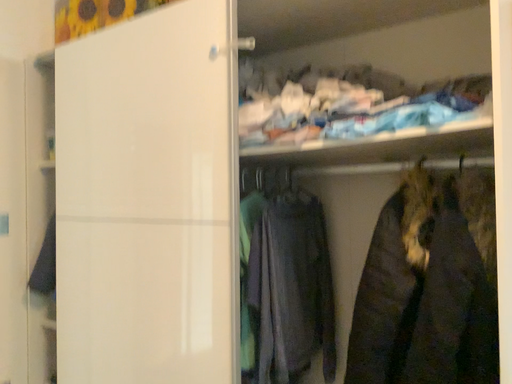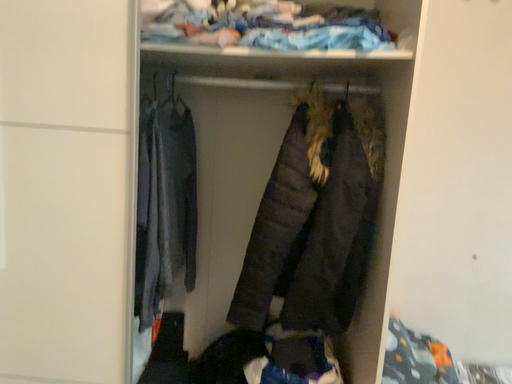
Question: How did the camera likely rotate when shooting the video?

Choices:
 (A) rotated left
 (B) rotated right

Answer: (B)